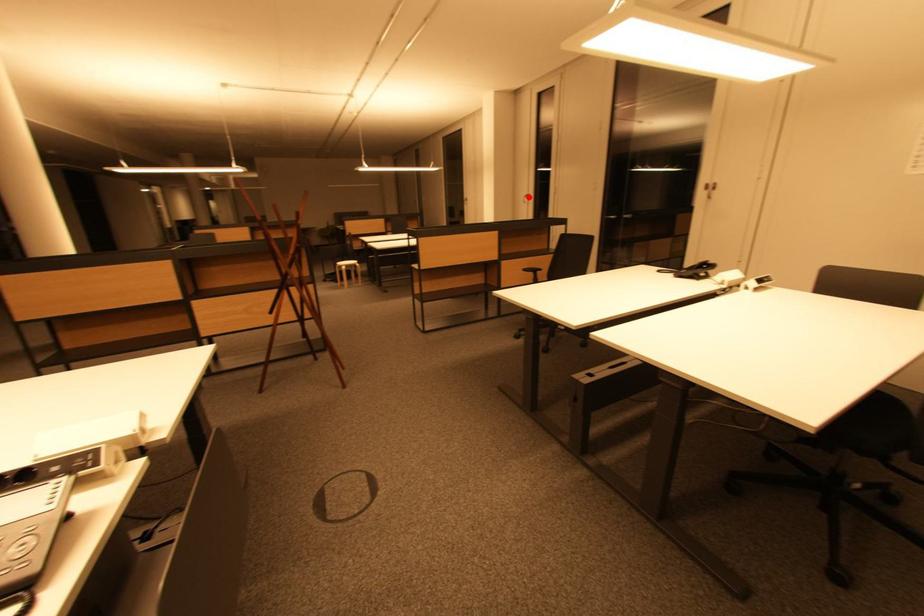
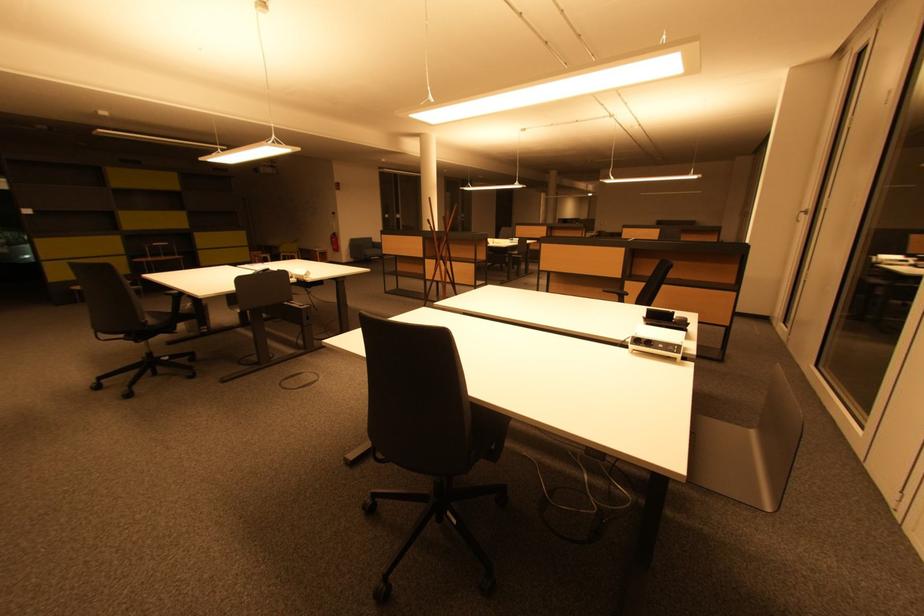
In the second image, find the point that corresponds to the highlighted location in the first image.

(808, 212)